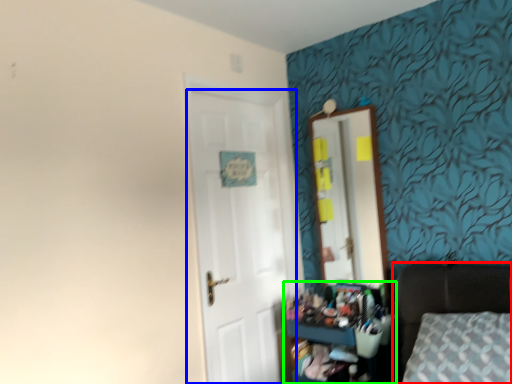
Question: Which is nearer to the furniture (highlighted by a red box)? door (highlighted by a blue box) or dresser (highlighted by a green box).

Choices:
 (A) door
 (B) dresser

Answer: (B)